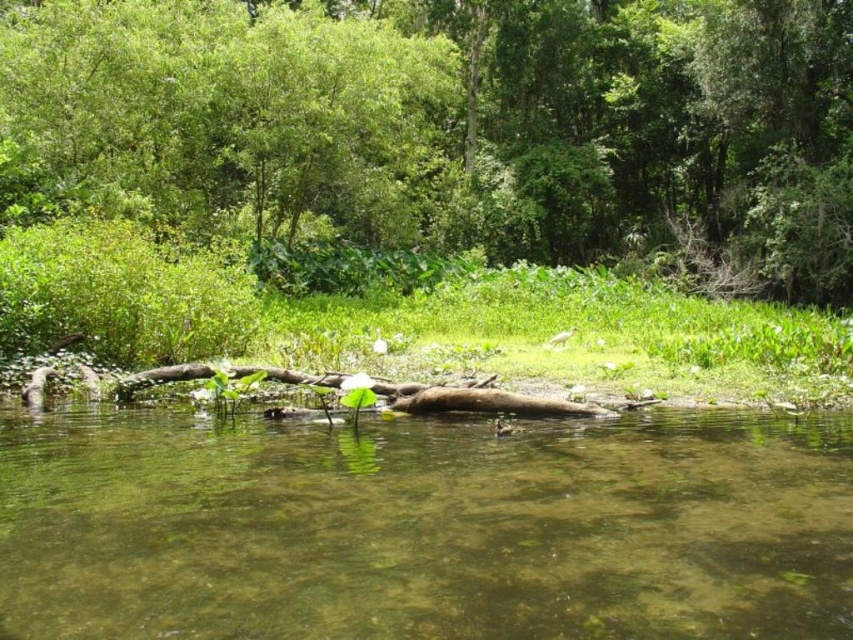
Question: Can you confirm if green leafy tree at upper center is positioned above green translucent water at center?

Choices:
 (A) no
 (B) yes

Answer: (B)

Question: Which object appears farthest from the camera in this image?

Choices:
 (A) green translucent water at center
 (B) green leafy tree at upper center

Answer: (B)

Question: Can you confirm if green leafy tree at upper center is wider than green translucent water at center?

Choices:
 (A) yes
 (B) no

Answer: (A)

Question: Is green leafy tree at upper center thinner than green translucent water at center?

Choices:
 (A) no
 (B) yes

Answer: (A)